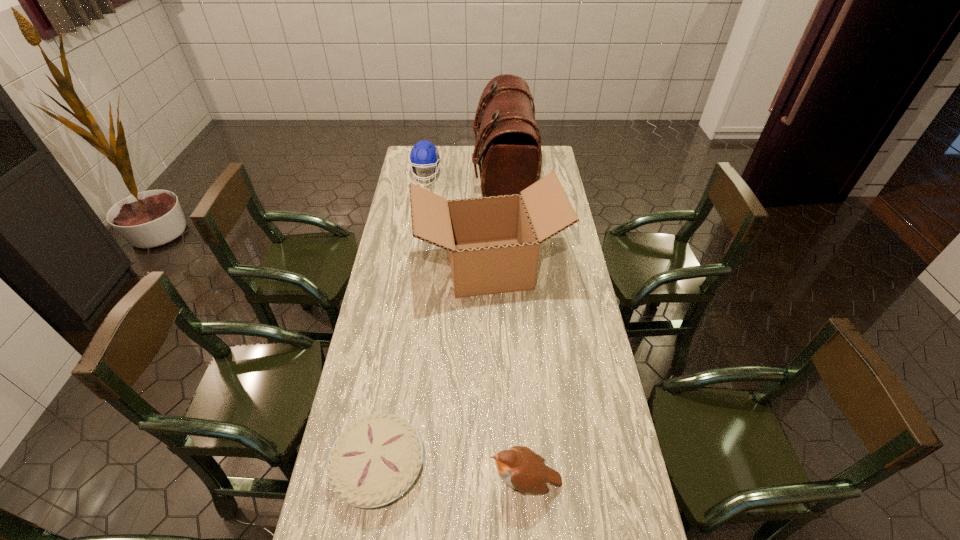
I want to click on satchel that is positioned at the right edge, so click(507, 148).

The image size is (960, 540). In order to click on box present at the right edge in this screenshot , I will do `click(493, 242)`.

This screenshot has height=540, width=960. Identify the location of object that is at the far left corner. (423, 154).

At what (x,y) coordinates should I click in order to perform the action: click on object that is at the far right corner. Please return your answer as a coordinate pair (x, y). This screenshot has width=960, height=540. Looking at the image, I should click on (507, 148).

At what (x,y) coordinates should I click in order to perform the action: click on free space at the far edge of the desktop. Please return your answer as a coordinate pair (x, y). This screenshot has width=960, height=540. Looking at the image, I should click on (470, 167).

Find the location of a particular element. vacant space at the left edge of the desktop is located at coordinates (382, 341).

In order to click on free space at the right edge of the desktop in this screenshot , I will do `click(596, 492)`.

Where is `blank area at the far right corner`? The height and width of the screenshot is (540, 960). blank area at the far right corner is located at coordinates (547, 153).

At what (x,y) coordinates should I click in order to perform the action: click on blank region between the pie and the football helmet. Please return your answer as a coordinate pair (x, y). Looking at the image, I should click on (402, 321).

This screenshot has width=960, height=540. What are the coordinates of `free space between the football helmet and the bird` in the screenshot? It's located at (475, 329).